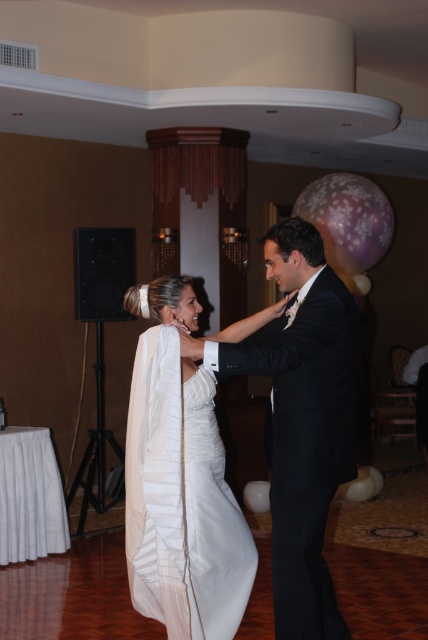
You are standing at the point labeled point (317, 266) in the image. The banquet hall has a 3.5 meter high ceiling. If you want to hang a decoration from the ceiling directly above your current position, will the decoration be within the ceiling height?

The point labeled point (317, 266) is 3.31 meters away from the viewer. Since the ceiling is 3.5 meters high, the decoration hung from the ceiling directly above this point will be within the ceiling height as it is only 3.31 meters from the viewer, which is below the 3.5 meter ceiling height.

You are a photographer at the wedding reception. You want to capture a closeup shot of the bride and groom dancing. Given that your camera frame can only accommodate objects up to the width of the satin white dress at center, will the black satin suit at center fit within the frame?

→ The black satin suit at center might be wider than the satin white dress at center, so it may not fit within the camera frame designed for the width of the satin white dress at center.